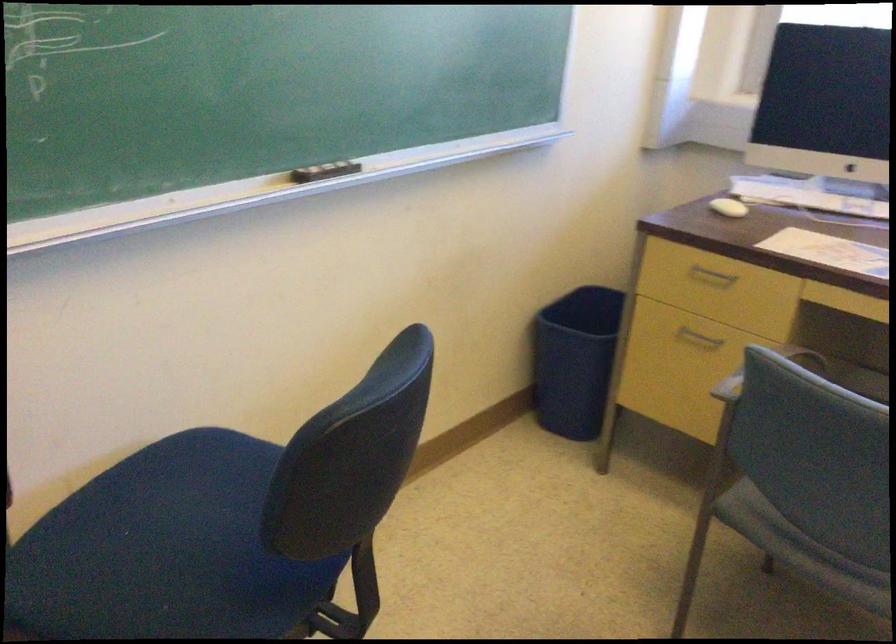
Find where to sit the blue chair sitting surface. Please return your answer as a coordinate pair (x, y).

(165, 550)